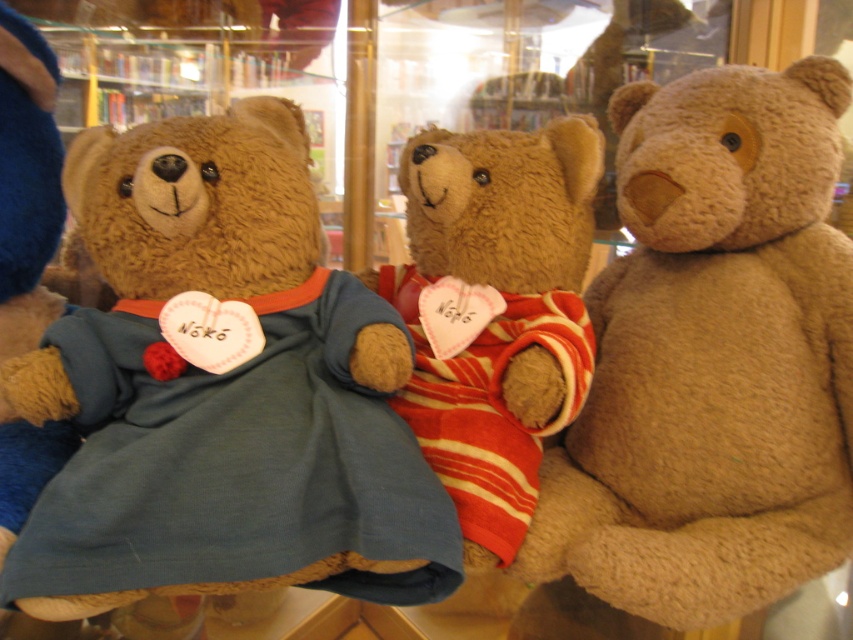
Question: Can you confirm if velvety brown teddy bear at center is thinner than fuzzy brown teddy bear at right?

Choices:
 (A) no
 (B) yes

Answer: (A)

Question: Can you confirm if fuzzy brown teddy bear at right is wider than soft brown teddy bear at center?

Choices:
 (A) no
 (B) yes

Answer: (B)

Question: From the image, what is the correct spatial relationship of velvety brown teddy bear at center in relation to fuzzy brown teddy bear at right?

Choices:
 (A) below
 (B) above

Answer: (B)

Question: Estimate the real-world distances between objects in this image. Which object is farther from the velvety brown teddy bear at center?

Choices:
 (A) soft brown teddy bear at center
 (B) fuzzy brown teddy bear at right

Answer: (B)

Question: Which of these objects is positioned closest to the velvety brown teddy bear at center?

Choices:
 (A) soft brown teddy bear at center
 (B) fuzzy brown teddy bear at right

Answer: (A)

Question: Which of these objects is positioned farthest from the fuzzy brown teddy bear at right?

Choices:
 (A) soft brown teddy bear at center
 (B) velvety brown teddy bear at center

Answer: (B)